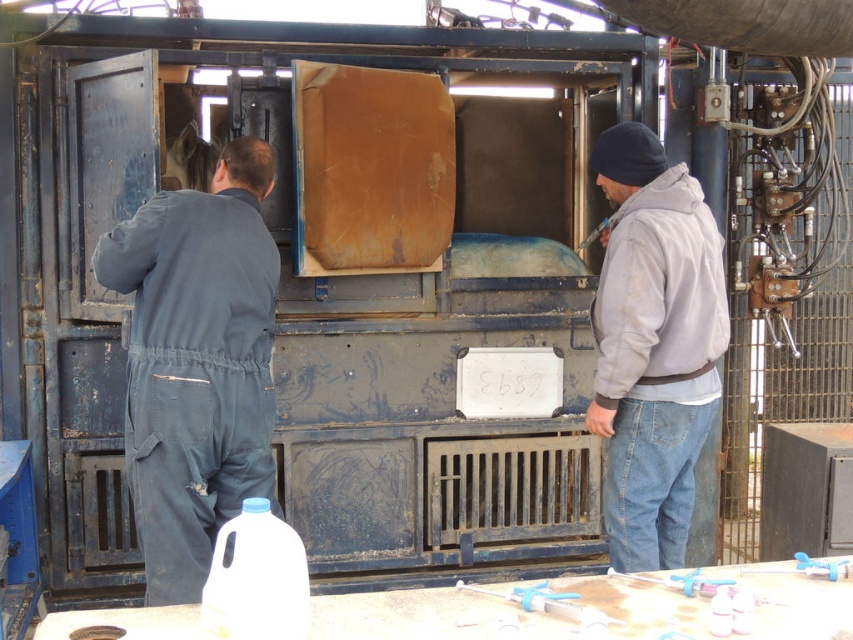
Question: Can you confirm if dark grey coveralls at left is wider than white plastic bottle at lower left?

Choices:
 (A) no
 (B) yes

Answer: (B)

Question: Estimate the real-world distances between objects in this image. Which object is closer to the gray fleece jacket at right?

Choices:
 (A) white plastic bottle at lower left
 (B) dark grey coveralls at left

Answer: (B)

Question: Considering the relative positions of dark grey coveralls at left and gray fleece jacket at right in the image provided, where is dark grey coveralls at left located with respect to gray fleece jacket at right?

Choices:
 (A) left
 (B) right

Answer: (A)

Question: Can you confirm if dark grey coveralls at left is positioned above white plastic bottle at lower left?

Choices:
 (A) yes
 (B) no

Answer: (A)

Question: Considering the real-world distances, which object is closest to the white plastic bottle at lower left?

Choices:
 (A) gray fleece jacket at right
 (B) dark grey coveralls at left

Answer: (B)

Question: Based on their relative distances, which object is nearer to the white plastic bottle at lower left?

Choices:
 (A) dark grey coveralls at left
 (B) gray fleece jacket at right

Answer: (A)